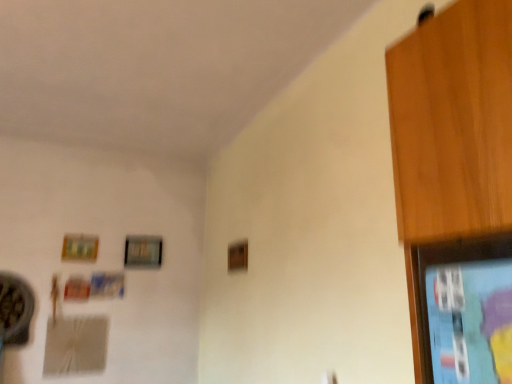
The width and height of the screenshot is (512, 384). What do you see at coordinates (143, 252) in the screenshot?
I see `wooden picture frame at upper center, the 2th picture frame in the left-to-right sequence` at bounding box center [143, 252].

Find the location of a particular element. wooden picture frame at upper center, which is the second picture frame in front-to-back order is located at coordinates (143, 252).

From the picture: Measure the distance between wooden picture frame at upper left, which is the first picture frame from front to back, and camera.

A distance of 3.23 meters exists between wooden picture frame at upper left, which is the first picture frame from front to back, and camera.

In order to face wooden picture frame at upper left, acting as the 2th picture frame starting from the right, should I rotate leftwards or rightwards?

To align with it, rotate left about 22.277°.

Where is `wooden picture frame at upper left, which is the first picture frame from front to back`? This screenshot has width=512, height=384. wooden picture frame at upper left, which is the first picture frame from front to back is located at coordinates click(x=80, y=247).

The height and width of the screenshot is (384, 512). What do you see at coordinates (80, 247) in the screenshot? I see `wooden picture frame at upper left, which is the first picture frame from front to back` at bounding box center [80, 247].

At what (x,y) coordinates should I click in order to perform the action: click on wooden picture frame at upper center, arranged as the 1th picture frame when viewed from the back. Please return your answer as a coordinate pair (x, y). Image resolution: width=512 pixels, height=384 pixels. Looking at the image, I should click on (143, 252).

Does wooden picture frame at upper left, which is the 1th picture frame from left to right, appear on the left side of wooden picture frame at upper center, arranged as the 1th picture frame when viewed from the back?

Yes, wooden picture frame at upper left, which is the 1th picture frame from left to right, is to the left of wooden picture frame at upper center, arranged as the 1th picture frame when viewed from the back.

Is the depth of wooden picture frame at upper left, which is the 1th picture frame from left to right, greater than that of wooden picture frame at upper center, the 1th picture frame in the right-to-left sequence?

No.

Which is less distant, (69, 235) or (149, 261)?

Point (69, 235) is closer to the camera than point (149, 261).

From the image's perspective, is wooden picture frame at upper left, which is the first picture frame from front to back, located beneath wooden picture frame at upper center, which is the second picture frame in front-to-back order?

No, from the image's perspective, wooden picture frame at upper left, which is the first picture frame from front to back, is not below wooden picture frame at upper center, which is the second picture frame in front-to-back order.

From a real-world perspective, is wooden picture frame at upper left, which is the 1th picture frame from left to right, physically above wooden picture frame at upper center, the 2th picture frame in the left-to-right sequence?

Yes, from a real-world perspective, wooden picture frame at upper left, which is the 1th picture frame from left to right, is above wooden picture frame at upper center, the 2th picture frame in the left-to-right sequence.

Consider the image. Can you confirm if wooden picture frame at upper left, acting as the 2th picture frame starting from the right, is thinner than wooden picture frame at upper center, arranged as the 1th picture frame when viewed from the back?

Yes.

Can you confirm if wooden picture frame at upper left, positioned as the 2th picture frame in back-to-front order, is shorter than wooden picture frame at upper center, which is the second picture frame in front-to-back order?

Indeed, wooden picture frame at upper left, positioned as the 2th picture frame in back-to-front order, has a lesser height compared to wooden picture frame at upper center, which is the second picture frame in front-to-back order.

Looking at the image, does wooden picture frame at upper left, which is the 1th picture frame from left to right, seem bigger or smaller compared to wooden picture frame at upper center, the 1th picture frame in the right-to-left sequence?

In the image, wooden picture frame at upper left, which is the 1th picture frame from left to right, appears to be smaller than wooden picture frame at upper center, the 1th picture frame in the right-to-left sequence.

Is wooden picture frame at upper left, which is the first picture frame from front to back, surrounding wooden picture frame at upper center, arranged as the 1th picture frame when viewed from the back?

Actually, wooden picture frame at upper center, arranged as the 1th picture frame when viewed from the back, is outside wooden picture frame at upper left, which is the first picture frame from front to back.

Is wooden picture frame at upper left, positioned as the 2th picture frame in back-to-front order, not close to wooden picture frame at upper center, the 1th picture frame in the right-to-left sequence?

No.

Is wooden picture frame at upper left, which is the first picture frame from front to back, looking in the opposite direction of wooden picture frame at upper center, which is the second picture frame in front-to-back order?

wooden picture frame at upper left, which is the first picture frame from front to back, is not turned away from wooden picture frame at upper center, which is the second picture frame in front-to-back order.

How many degrees apart are the facing directions of wooden picture frame at upper left, which is the first picture frame from front to back, and wooden picture frame at upper center, which is the second picture frame in front-to-back order?

The facing directions of wooden picture frame at upper left, which is the first picture frame from front to back, and wooden picture frame at upper center, which is the second picture frame in front-to-back order, are 0.415 degrees apart.

How distant is wooden picture frame at upper left, which is the 1th picture frame from left to right, from wooden picture frame at upper center, arranged as the 1th picture frame when viewed from the back?

A distance of 13.97 inches exists between wooden picture frame at upper left, which is the 1th picture frame from left to right, and wooden picture frame at upper center, arranged as the 1th picture frame when viewed from the back.

This screenshot has height=384, width=512. I want to click on picture frame on the right of wooden picture frame at upper left, which is the first picture frame from front to back, so click(x=143, y=252).

Visually, is wooden picture frame at upper center, which is the second picture frame in front-to-back order, positioned to the left or to the right of wooden picture frame at upper left, which is the 1th picture frame from left to right?

wooden picture frame at upper center, which is the second picture frame in front-to-back order, is to the right of wooden picture frame at upper left, which is the 1th picture frame from left to right.

Is wooden picture frame at upper center, the 2th picture frame in the left-to-right sequence, positioned before wooden picture frame at upper left, acting as the 2th picture frame starting from the right?

No.

Is point (141, 252) positioned before point (67, 256)?

No, (141, 252) is behind (67, 256).

From the image's perspective, is wooden picture frame at upper center, arranged as the 1th picture frame when viewed from the back, above or below wooden picture frame at upper left, which is the 1th picture frame from left to right?

From the image's perspective, wooden picture frame at upper center, arranged as the 1th picture frame when viewed from the back, appears below wooden picture frame at upper left, which is the 1th picture frame from left to right.

From a real-world perspective, is wooden picture frame at upper center, arranged as the 1th picture frame when viewed from the back, below wooden picture frame at upper left, acting as the 2th picture frame starting from the right?

Yes, from a real-world perspective, wooden picture frame at upper center, arranged as the 1th picture frame when viewed from the back, is below wooden picture frame at upper left, acting as the 2th picture frame starting from the right.

In terms of width, does wooden picture frame at upper center, the 1th picture frame in the right-to-left sequence, look wider or thinner when compared to wooden picture frame at upper left, positioned as the 2th picture frame in back-to-front order?

In the image, wooden picture frame at upper center, the 1th picture frame in the right-to-left sequence, appears to be wider than wooden picture frame at upper left, positioned as the 2th picture frame in back-to-front order.

Can you confirm if wooden picture frame at upper center, the 2th picture frame in the left-to-right sequence, is shorter than wooden picture frame at upper left, positioned as the 2th picture frame in back-to-front order?

Incorrect, the height of wooden picture frame at upper center, the 2th picture frame in the left-to-right sequence, does not fall short of that of wooden picture frame at upper left, positioned as the 2th picture frame in back-to-front order.

Who is bigger, wooden picture frame at upper center, the 1th picture frame in the right-to-left sequence, or wooden picture frame at upper left, positioned as the 2th picture frame in back-to-front order?

wooden picture frame at upper center, the 1th picture frame in the right-to-left sequence, is bigger.

Does wooden picture frame at upper center, the 2th picture frame in the left-to-right sequence, contain wooden picture frame at upper left, positioned as the 2th picture frame in back-to-front order?

No, wooden picture frame at upper left, positioned as the 2th picture frame in back-to-front order, is not inside wooden picture frame at upper center, the 2th picture frame in the left-to-right sequence.

Is wooden picture frame at upper center, the 2th picture frame in the left-to-right sequence, far away from wooden picture frame at upper left, positioned as the 2th picture frame in back-to-front order?

That's not correct — wooden picture frame at upper center, the 2th picture frame in the left-to-right sequence, is a little close to wooden picture frame at upper left, positioned as the 2th picture frame in back-to-front order.

Is wooden picture frame at upper center, the 2th picture frame in the left-to-right sequence, turned away from wooden picture frame at upper left, acting as the 2th picture frame starting from the right?

No.

How different are the orientations of wooden picture frame at upper center, arranged as the 1th picture frame when viewed from the back, and wooden picture frame at upper left, which is the first picture frame from front to back, in degrees?

0.415 degrees separate the facing orientations of wooden picture frame at upper center, arranged as the 1th picture frame when viewed from the back, and wooden picture frame at upper left, which is the first picture frame from front to back.

The width and height of the screenshot is (512, 384). In order to click on picture frame positioned vertically above the wooden picture frame at upper center, which is the second picture frame in front-to-back order (from a real-world perspective) in this screenshot , I will do `click(80, 247)`.

This screenshot has height=384, width=512. Find the location of `picture frame behind the wooden picture frame at upper left, which is the first picture frame from front to back`. picture frame behind the wooden picture frame at upper left, which is the first picture frame from front to back is located at coordinates (143, 252).

Where is `picture frame above the wooden picture frame at upper center, arranged as the 1th picture frame when viewed from the back (from a real-world perspective)`? The height and width of the screenshot is (384, 512). picture frame above the wooden picture frame at upper center, arranged as the 1th picture frame when viewed from the back (from a real-world perspective) is located at coordinates (80, 247).